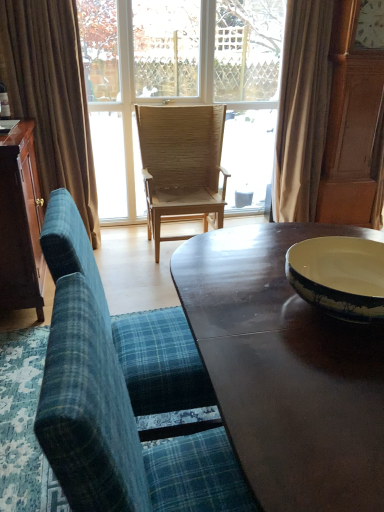
Question: Is blue plaid fabric chair at lower left, the 1th chair positioned from the front, next to brown fabric curtain at left, which is the 2th curtain from right to left, and touching it?

Choices:
 (A) yes
 (B) no

Answer: (B)

Question: From a real-world perspective, is blue plaid fabric chair at lower left, which is the 3th chair in back-to-front order, on top of brown fabric curtain at left, marked as the first curtain in a left-to-right arrangement?

Choices:
 (A) no
 (B) yes

Answer: (A)

Question: Are blue plaid fabric chair at lower left, the 1th chair positioned from the front, and brown fabric curtain at left, marked as the first curtain in a left-to-right arrangement, far apart?

Choices:
 (A) no
 (B) yes

Answer: (B)

Question: Considering the relative sizes of blue plaid fabric chair at lower left, which is the 3th chair in back-to-front order, and brown fabric curtain at left, marked as the first curtain in a left-to-right arrangement, in the image provided, is blue plaid fabric chair at lower left, which is the 3th chair in back-to-front order, smaller than brown fabric curtain at left, marked as the first curtain in a left-to-right arrangement,?

Choices:
 (A) yes
 (B) no

Answer: (B)

Question: Can you confirm if blue plaid fabric chair at lower left, the 1th chair positioned from the front, is wider than brown fabric curtain at left, marked as the first curtain in a left-to-right arrangement?

Choices:
 (A) no
 (B) yes

Answer: (B)

Question: Is blue plaid fabric chair at lower left, which is the 3th chair in back-to-front order, aimed at brown fabric curtain at left, which is the 2th curtain from right to left?

Choices:
 (A) yes
 (B) no

Answer: (B)

Question: Can you see dark brown wood cabinet at left touching blue plaid fabric chair at lower left, the 1th chair positioned from the front?

Choices:
 (A) no
 (B) yes

Answer: (A)

Question: Can you confirm if dark brown wood cabinet at left is wider than blue plaid fabric chair at lower left, the 1th chair positioned from the front?

Choices:
 (A) yes
 (B) no

Answer: (B)

Question: Is dark brown wood cabinet at left at the left side of blue plaid fabric chair at lower left, which is the 3th chair in back-to-front order?

Choices:
 (A) yes
 (B) no

Answer: (A)

Question: Can you confirm if dark brown wood cabinet at left is thinner than blue plaid fabric chair at lower left, the 1th chair positioned from the front?

Choices:
 (A) yes
 (B) no

Answer: (A)

Question: Considering the relative positions of dark brown wood cabinet at left and blue plaid fabric chair at lower left, the 1th chair positioned from the front, in the image provided, is dark brown wood cabinet at left behind blue plaid fabric chair at lower left, the 1th chair positioned from the front,?

Choices:
 (A) no
 (B) yes

Answer: (B)

Question: From a real-world perspective, is dark brown wood cabinet at left over blue plaid fabric chair at lower left, which is the 3th chair in back-to-front order?

Choices:
 (A) yes
 (B) no

Answer: (B)

Question: Considering the relative sizes of beige fabric curtain at upper right, which is the 1th curtain in right-to-left order, and blue plaid fabric chair at lower left, which is the 3th chair in back-to-front order, in the image provided, is beige fabric curtain at upper right, which is the 1th curtain in right-to-left order, wider than blue plaid fabric chair at lower left, which is the 3th chair in back-to-front order,?

Choices:
 (A) no
 (B) yes

Answer: (A)